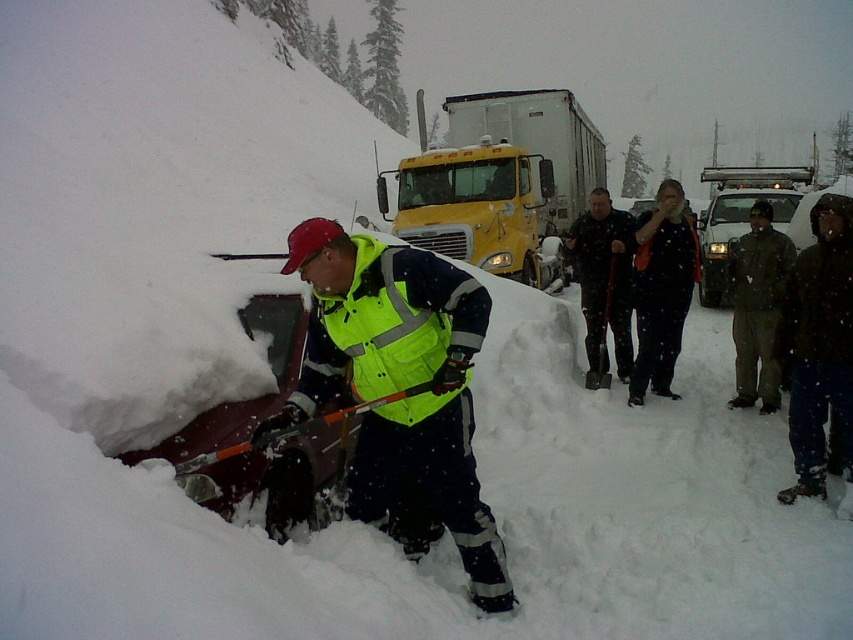
Question: Which point is farther to the camera?

Choices:
 (A) dark brown leather jacket at center
 (B) brown fuzzy jacket at right

Answer: (A)

Question: Which point is farther to the camera?

Choices:
 (A) (764, 278)
 (B) (397, 369)

Answer: (A)

Question: Does brown fuzzy jacket at right have a larger size compared to dark brown leather jacket at center?

Choices:
 (A) yes
 (B) no

Answer: (B)

Question: Which point is farther to the camera?

Choices:
 (A) neon yellow reflective vest at center
 (B) dark brown leather jacket at center
 (C) neon yellow reflective safety vest at center

Answer: (B)

Question: Can you confirm if neon yellow reflective vest at center is thinner than brown fuzzy jacket at right?

Choices:
 (A) no
 (B) yes

Answer: (A)

Question: Can you confirm if neon yellow reflective vest at center is wider than dark brown leather jacket at center?

Choices:
 (A) no
 (B) yes

Answer: (B)